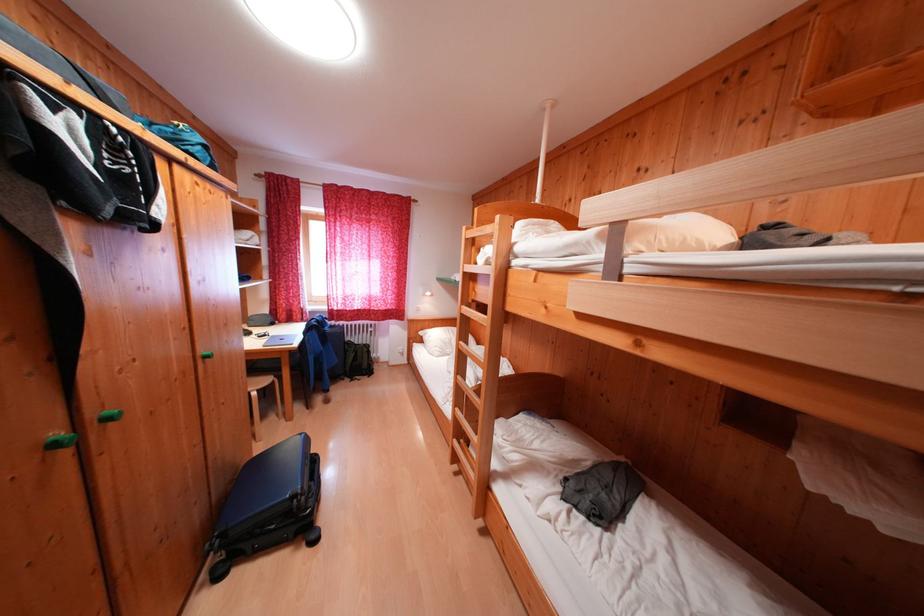
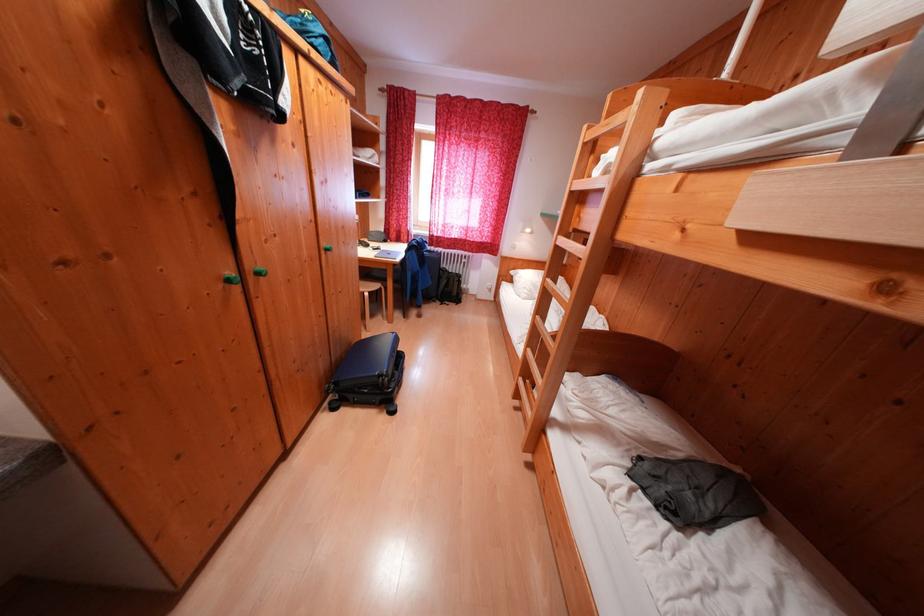
Question: The first image is from the beginning of the video and the second image is from the end. How did the camera likely rotate when shooting the video?

Choices:
 (A) Left
 (B) Right
 (C) Up
 (D) Down

Answer: (A)